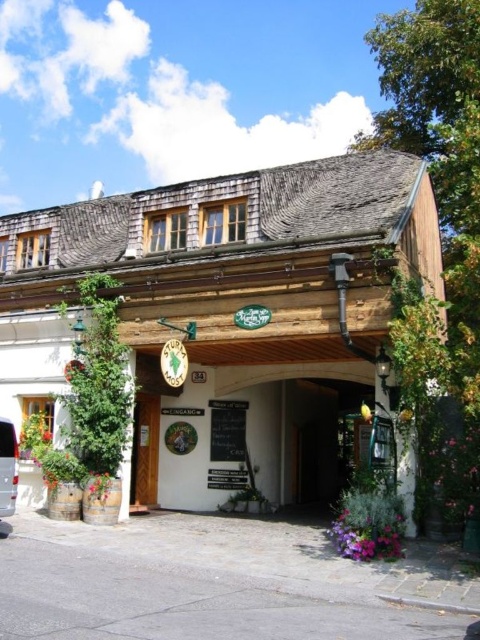
You are standing in front of the white wood building at center and the wooden door at center. Which object is positioned higher from the ground?

The white wood building at center is located above the wooden door at center, so the white wood building at center is positioned higher from the ground.

You are standing in front of the white wood building at center and the wooden door at center. Which object is positioned to the right side?

The white wood building at center is to the right of the wooden door at center.

You are standing in front of the rustic building and want to take a photo. You notice two points marked on the building facade. The first point is at coordinates point (160, 316) and the second is at point (11, 452). Which point will appear closer to the camera in your photo?

Point (160, 316) is further to the camera than point (11, 452), so in the photo, point (160, 316) will appear closer to the camera than point (11, 452).